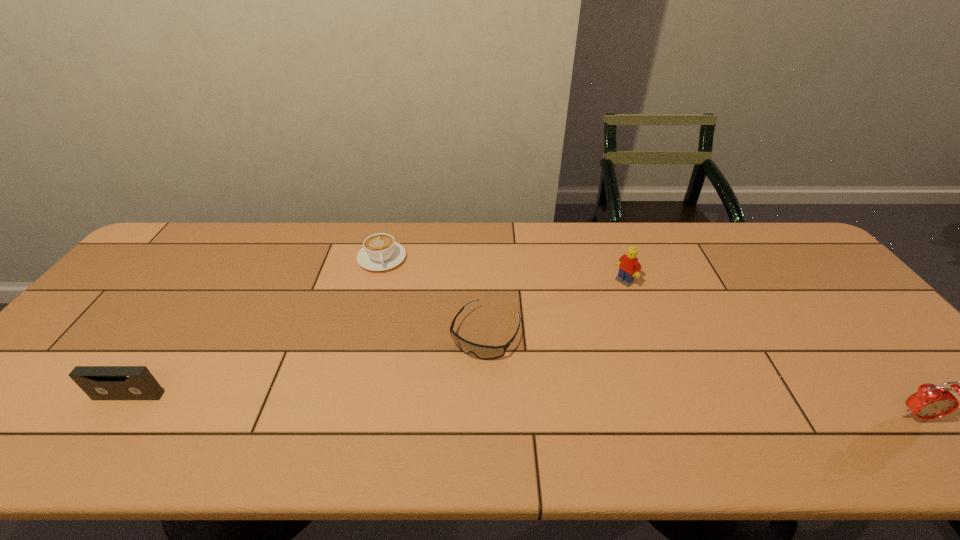
I want to click on free space between the second object from right to left and the nearest object, so click(x=771, y=349).

Identify the location of free point between the Lego and the second object from left to right. This screenshot has height=540, width=960. (503, 270).

Find the location of a particular element. free point between the third shortest object and the third object from right to left is located at coordinates (307, 364).

You are a GUI agent. You are given a task and a screenshot of the screen. Output one action in this format:
    pyautogui.click(x=<x>, y=<y>)
    Task: Click on the unoccupied area between the cappuccino and the Lego
    This screenshot has height=540, width=960.
    Given the screenshot: What is the action you would take?
    pyautogui.click(x=503, y=270)

At what (x,y) coordinates should I click in order to perform the action: click on empty space that is in between the cappuccino and the nearest object. Please return your answer as a coordinate pair (x, y). The height and width of the screenshot is (540, 960). Looking at the image, I should click on coord(650,338).

Where is `the closest object to the Lego`? the closest object to the Lego is located at coordinates (485, 352).

Select which object appears as the fourth closest to the second object from right to left. Please provide its 2D coordinates. Your answer should be formatted as a tuple, i.e. [(x, y)], where the tuple contains the x and y coordinates of a point satisfying the conditions above.

[(99, 382)]

Where is `vacant position in the image that satisfies the following two spatial constraints: 1. on the front side of the third nearest object; 2. on the left side of the cappuccino`? vacant position in the image that satisfies the following two spatial constraints: 1. on the front side of the third nearest object; 2. on the left side of the cappuccino is located at coordinates (362, 333).